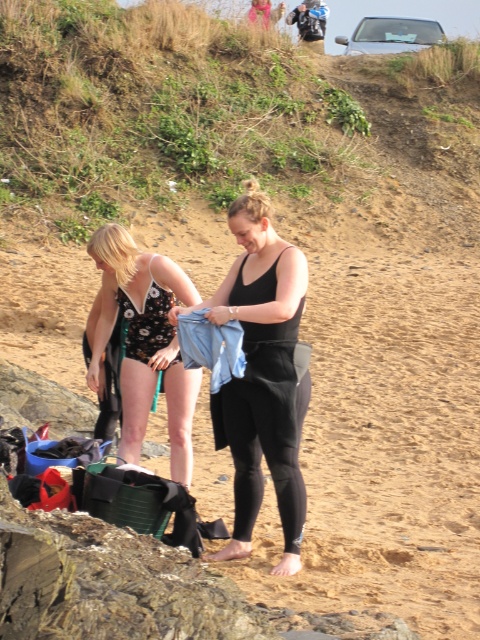
Between black matte tank top at center and black floral swimsuit at left, which one appears on the left side from the viewer's perspective?

Positioned to the left is black floral swimsuit at left.

Which is below, black matte tank top at center or black floral swimsuit at left?

Positioned lower is black matte tank top at center.

I want to click on black matte tank top at center, so click(263, 376).